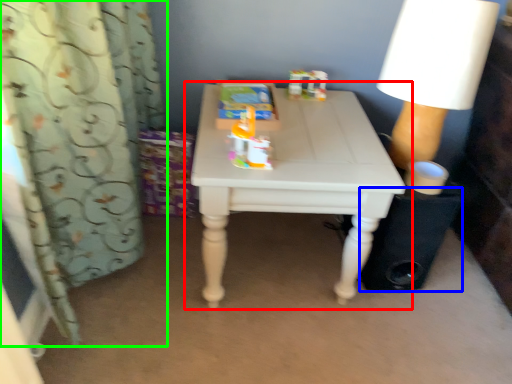
Question: Which object is the farthest from table (highlighted by a red box)? Choose among these: speaker (highlighted by a blue box) or curtain (highlighted by a green box).

Choices:
 (A) speaker
 (B) curtain

Answer: (B)